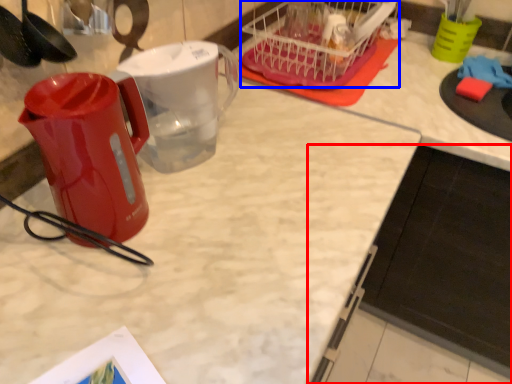
Question: Which object is further to the camera taking this photo, cabinetry (highlighted by a red box) or basket (highlighted by a blue box)?

Choices:
 (A) cabinetry
 (B) basket

Answer: (B)